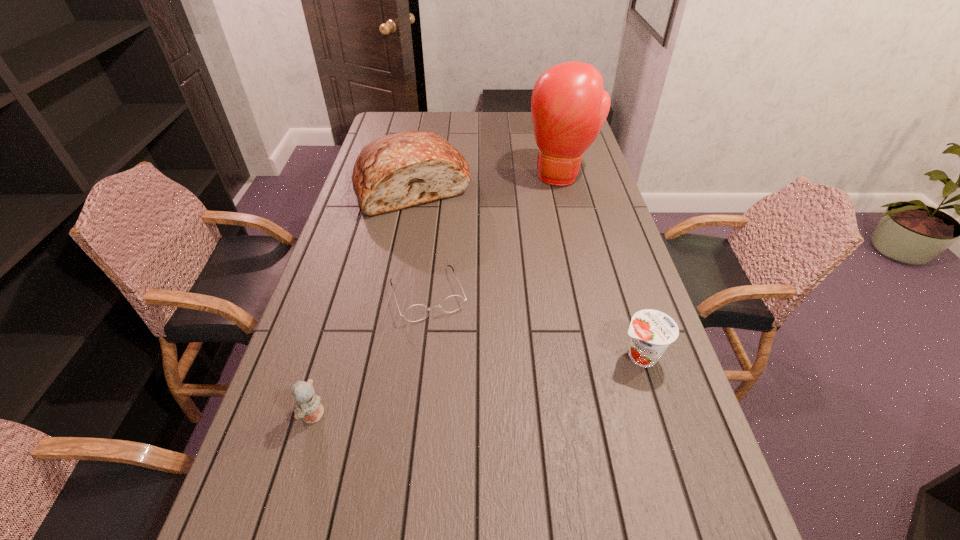
Where is `vacant space located 0.200m at the sliced front of the bread`? Image resolution: width=960 pixels, height=540 pixels. vacant space located 0.200m at the sliced front of the bread is located at coordinates (442, 257).

Locate an element on the screen. Image resolution: width=960 pixels, height=540 pixels. vacant area located 0.150m at the sliced front of the bread is located at coordinates (438, 247).

Where is `vacant region located 0.400m at the sliced front of the bread`? The image size is (960, 540). vacant region located 0.400m at the sliced front of the bread is located at coordinates (460, 303).

The image size is (960, 540). In order to click on free space located on the striking surface of the tallest object in this screenshot , I will do `click(540, 241)`.

Image resolution: width=960 pixels, height=540 pixels. I want to click on free spot located on the striking surface of the tallest object, so click(x=540, y=240).

Identify the location of vacant space situated on the striking surface of the tallest object. Image resolution: width=960 pixels, height=540 pixels. (x=539, y=246).

The image size is (960, 540). I want to click on teddy bear that is at the left edge, so click(309, 408).

Where is `bread located in the left edge section of the desktop`? bread located in the left edge section of the desktop is located at coordinates (395, 171).

Find the location of a particular element. The image size is (960, 540). yogurt present at the right edge is located at coordinates (651, 331).

In order to click on boxing glove that is at the right edge in this screenshot , I will do `click(569, 106)`.